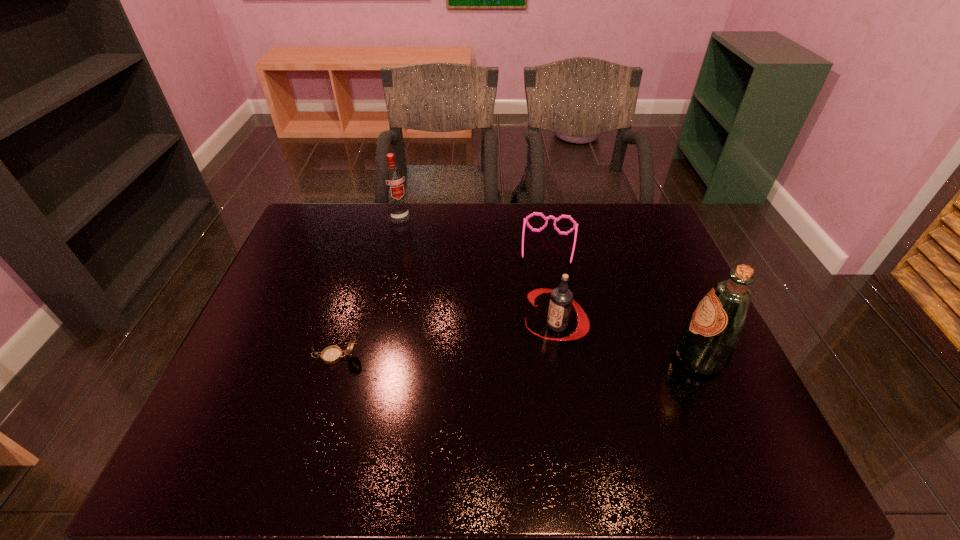
At what (x,y) coordinates should I click in order to perform the action: click on free spot on the desktop that is between the compass and the olive oil and is positioned on the arms of the spectacles. Please return your answer as a coordinate pair (x, y). This screenshot has width=960, height=540. Looking at the image, I should click on (539, 357).

You are a GUI agent. You are given a task and a screenshot of the screen. Output one action in this format:
    pyautogui.click(x=<x>, y=<y>)
    Task: Click on the vacant space on the desktop that is between the compass and the olive oil and is positioned on the label of the third shortest object
    This screenshot has height=540, width=960.
    Given the screenshot: What is the action you would take?
    pyautogui.click(x=492, y=357)

At what (x,y) coordinates should I click in order to perform the action: click on free space on the desktop that is between the compass and the tallest object and is positioned on the front label of the fourth shortest object. Please return your answer as a coordinate pair (x, y). This screenshot has width=960, height=540. Looking at the image, I should click on (471, 357).